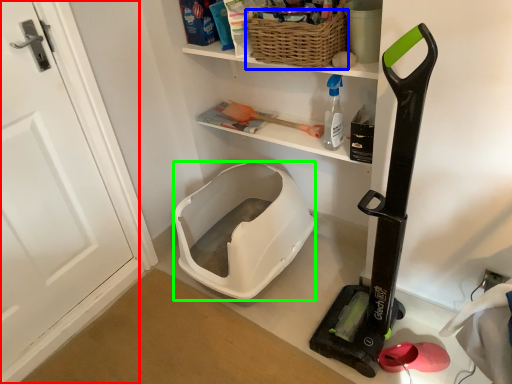
Question: Which object is the closest to the door (highlighted by a red box)? Choose among these: basket (highlighted by a blue box) or wide (highlighted by a green box).

Choices:
 (A) basket
 (B) wide

Answer: (B)